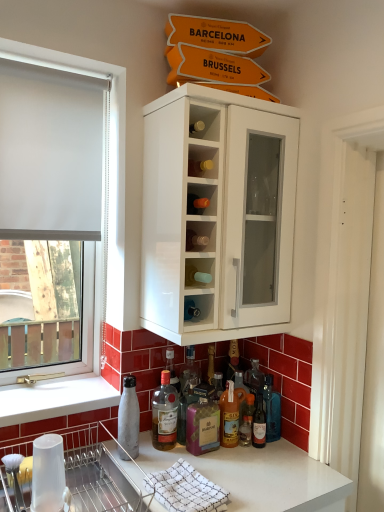
Question: Is white wood screen door at right positioned before metallic silver bottle at lower left, the first bottle from the left?

Choices:
 (A) yes
 (B) no

Answer: (A)

Question: Does white wood screen door at right turn towards metallic silver bottle at lower left, the sixth bottle positioned from the right?

Choices:
 (A) no
 (B) yes

Answer: (A)

Question: Is the depth of white wood screen door at right greater than that of metallic silver bottle at lower left, the sixth bottle positioned from the right?

Choices:
 (A) yes
 (B) no

Answer: (B)

Question: Considering the relative sizes of white wood screen door at right and metallic silver bottle at lower left, the first bottle from the left, in the image provided, is white wood screen door at right bigger than metallic silver bottle at lower left, the first bottle from the left,?

Choices:
 (A) no
 (B) yes

Answer: (B)

Question: Considering the relative positions of white wood screen door at right and metallic silver bottle at lower left, the sixth bottle positioned from the right, in the image provided, is white wood screen door at right to the left of metallic silver bottle at lower left, the sixth bottle positioned from the right, from the viewer's perspective?

Choices:
 (A) no
 (B) yes

Answer: (A)

Question: Is white wood screen door at right positioned with its back to metallic silver bottle at lower left, the sixth bottle positioned from the right?

Choices:
 (A) yes
 (B) no

Answer: (B)

Question: Could metallic silver dish rack at lower left be considered to be inside translucent glass bottle at lower center, placed as the 2th bottle when sorted from right to left?

Choices:
 (A) yes
 (B) no

Answer: (B)

Question: Is metallic silver dish rack at lower left at the back of translucent glass bottle at lower center, placed as the 2th bottle when sorted from right to left?

Choices:
 (A) yes
 (B) no

Answer: (B)

Question: Does translucent glass bottle at lower center, placed as the 2th bottle when sorted from right to left, come behind metallic silver dish rack at lower left?

Choices:
 (A) yes
 (B) no

Answer: (A)

Question: Considering the relative sizes of translucent glass bottle at lower center, the fifth bottle positioned from the left, and metallic silver dish rack at lower left in the image provided, is translucent glass bottle at lower center, the fifth bottle positioned from the left, smaller than metallic silver dish rack at lower left?

Choices:
 (A) yes
 (B) no

Answer: (A)

Question: From a real-world perspective, is translucent glass bottle at lower center, the fifth bottle positioned from the left, on top of metallic silver dish rack at lower left?

Choices:
 (A) no
 (B) yes

Answer: (B)

Question: From the image's perspective, does translucent glass bottle at lower center, placed as the 2th bottle when sorted from right to left, appear lower than metallic silver dish rack at lower left?

Choices:
 (A) no
 (B) yes

Answer: (A)

Question: Is translucent glass bottle at lower center, which is the 3th bottle in left-to-right order, oriented towards translucent glass bottle at lower center, the sixth bottle when ordered from left to right?

Choices:
 (A) yes
 (B) no

Answer: (B)